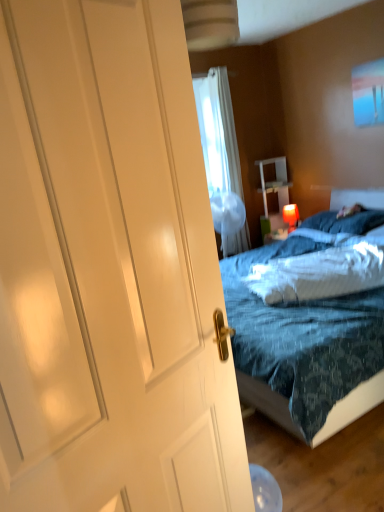
Question: Would you say matte red lampshade at upper right is inside or outside blue soft pillow at center, which is the 2th pillow from front to back?

Choices:
 (A) inside
 (B) outside

Answer: (B)

Question: From the image's perspective, is matte red lampshade at upper right positioned above or below blue soft pillow at center, which is the first pillow in back-to-front order?

Choices:
 (A) above
 (B) below

Answer: (A)

Question: Which object is positioned farthest from the white sheer curtain at upper center?

Choices:
 (A) blue soft pillow at center, which ranks as the 1th pillow in top-to-bottom order
 (B) white glossy nightstand at center
 (C) white glossy door at left
 (D) white fluffy pillow at center, arranged as the 2th pillow when viewed from the back
 (E) matte red lampshade at upper right

Answer: (C)

Question: Based on their relative distances, which object is nearer to the matte red lampshade at upper right?

Choices:
 (A) white fluffy pillow at center, placed as the 1th pillow when sorted from bottom to top
 (B) white glossy nightstand at center
 (C) white glossy door at left
 (D) white sheer curtain at upper center
 (E) blue soft pillow at center, which is the first pillow in back-to-front order

Answer: (B)